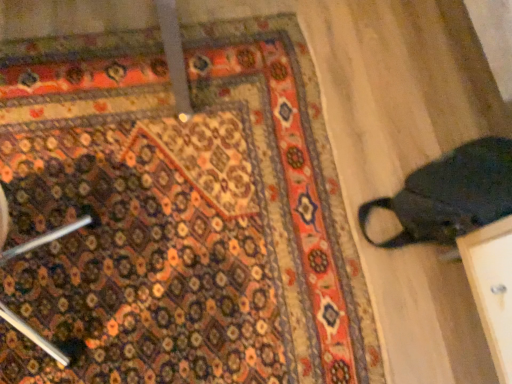
Question: From the image's perspective, is carpeted mat at lower left over dark fabric bag at right?

Choices:
 (A) yes
 (B) no

Answer: (B)

Question: Can you confirm if carpeted mat at lower left is shorter than dark fabric bag at right?

Choices:
 (A) no
 (B) yes

Answer: (B)

Question: Is the surface of carpeted mat at lower left in direct contact with dark fabric bag at right?

Choices:
 (A) yes
 (B) no

Answer: (B)

Question: Can you confirm if carpeted mat at lower left is wider than dark fabric bag at right?

Choices:
 (A) no
 (B) yes

Answer: (B)

Question: Is carpeted mat at lower left in front of dark fabric bag at right?

Choices:
 (A) yes
 (B) no

Answer: (B)

Question: Does carpeted mat at lower left come behind dark fabric bag at right?

Choices:
 (A) yes
 (B) no

Answer: (A)

Question: Considering the relative sizes of dark fabric bag at right and carpeted mat at lower left in the image provided, is dark fabric bag at right bigger than carpeted mat at lower left?

Choices:
 (A) yes
 (B) no

Answer: (A)

Question: Is dark fabric bag at right taller than carpeted mat at lower left?

Choices:
 (A) no
 (B) yes

Answer: (B)

Question: Is the position of dark fabric bag at right more distant than that of carpeted mat at lower left?

Choices:
 (A) no
 (B) yes

Answer: (A)

Question: Is dark fabric bag at right not inside carpeted mat at lower left?

Choices:
 (A) no
 (B) yes

Answer: (B)

Question: Does dark fabric bag at right have a lesser height compared to carpeted mat at lower left?

Choices:
 (A) yes
 (B) no

Answer: (B)

Question: Is dark fabric bag at right thinner than carpeted mat at lower left?

Choices:
 (A) no
 (B) yes

Answer: (B)

Question: Do you think dark fabric bag at right is within carpeted mat at lower left, or outside of it?

Choices:
 (A) inside
 (B) outside

Answer: (B)